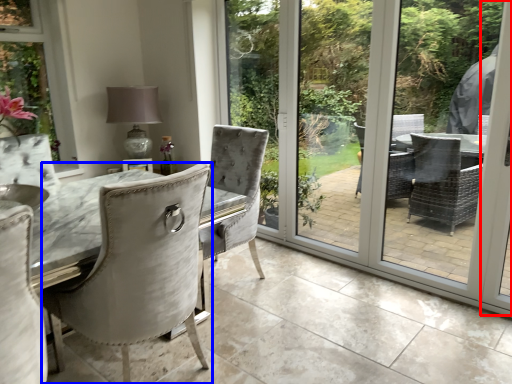
Question: Which of the following is the farthest to the observer, screen door (highlighted by a red box) or chair (highlighted by a blue box)?

Choices:
 (A) screen door
 (B) chair

Answer: (A)